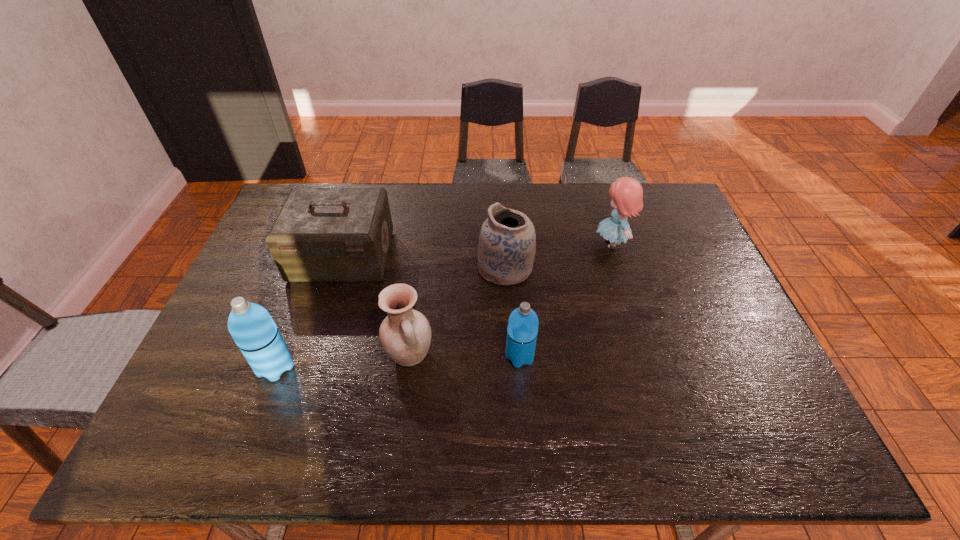
The height and width of the screenshot is (540, 960). I want to click on the left thermos bottle, so click(x=251, y=326).

At what (x,y) coordinates should I click in order to perform the action: click on the right thermos bottle. Please return your answer as a coordinate pair (x, y). The height and width of the screenshot is (540, 960). Looking at the image, I should click on (522, 330).

You are a GUI agent. You are given a task and a screenshot of the screen. Output one action in this format:
    pyautogui.click(x=<x>, y=<y>)
    Task: Click on the rightmost object
    This screenshot has height=540, width=960.
    Given the screenshot: What is the action you would take?
    pyautogui.click(x=626, y=193)

This screenshot has width=960, height=540. I want to click on the first-aid kit, so click(x=321, y=234).

Locate an element on the screen. The height and width of the screenshot is (540, 960). the third object from left to right is located at coordinates (405, 334).

You are a GUI agent. You are given a task and a screenshot of the screen. Output one action in this format:
    pyautogui.click(x=<x>, y=<y>)
    Task: Click on the nearer pottery
    This screenshot has width=960, height=540.
    Given the screenshot: What is the action you would take?
    pyautogui.click(x=405, y=334)

Identify the location of the farther pottery. (507, 241).

Identify the location of free spot located 0.280m on the back of the taller thermos bottle. (311, 274).

I want to click on vacant space located on the left of the right thermos bottle, so click(387, 356).

I want to click on vacant point located on the front-facing side of the rightmost object, so click(x=559, y=244).